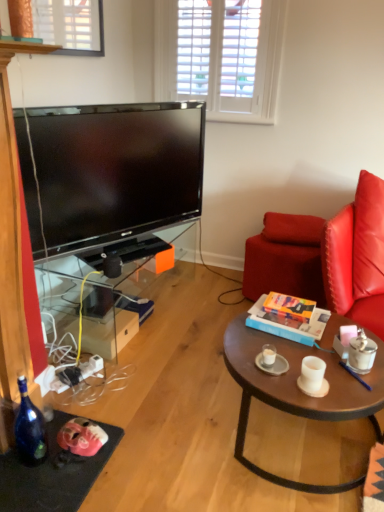
Question: From the image's perspective, is matte gray saucer at center above or below brown wooden coffee table at center?

Choices:
 (A) below
 (B) above

Answer: (B)

Question: Is point (279, 357) closer or farther from the camera than point (382, 370)?

Choices:
 (A) closer
 (B) farther

Answer: (B)

Question: Which of these objects is positioned farthest from the white matte coffee cup at center right, placed as the 2th coffee cup when sorted from right to left?

Choices:
 (A) brown wooden coffee table at center
 (B) leather swivel chair at right
 (C) metallic silver coffee cup at right, which ranks as the 1th coffee cup in right-to-left order
 (D) black plastic pen at center
 (E) red leather pillow at right

Answer: (E)

Question: Which object is positioned farthest from the matte gray saucer at center?

Choices:
 (A) transparent glass tv stand at left
 (B) metallic silver coffee cup at right, placed as the 3th coffee cup when sorted from left to right
 (C) white matte coffee cup at center right, the second coffee cup when ordered from left to right
 (D) brown wooden coffee table at center
 (E) hardcover book at center

Answer: (A)